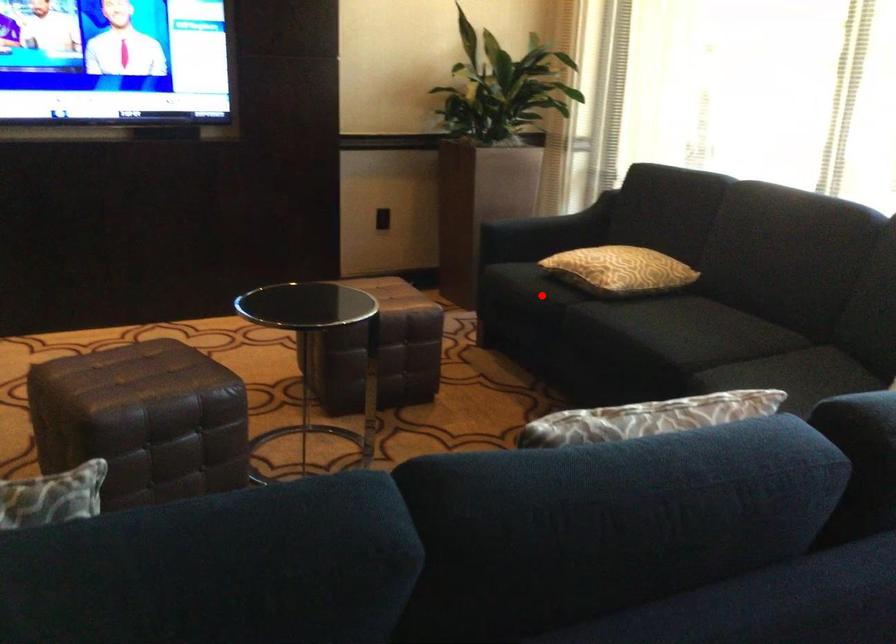
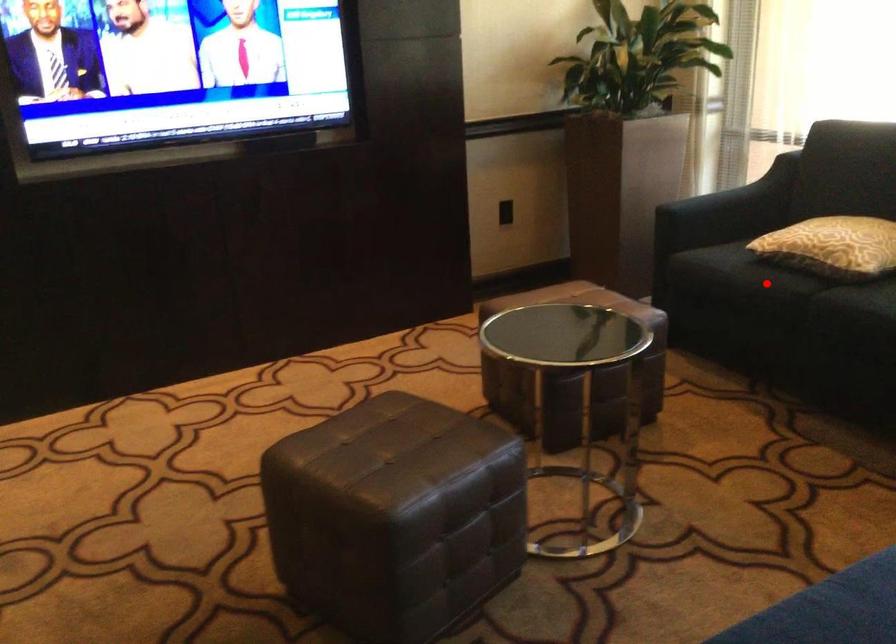
I am providing you with two images of the same scene from different viewpoints. A red point is marked on the first image and another point is marked on the second image. Do the highlighted points in image1 and image2 indicate the same real-world spot?

Yes